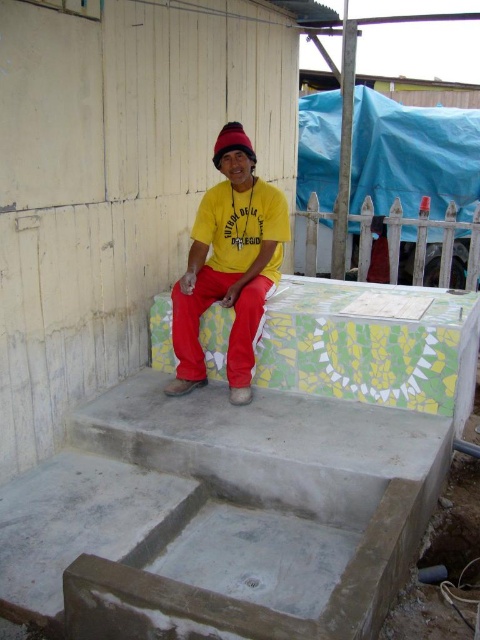
The man in the image is wearing a yellow matte shirt at center and a knitted woolen beanie at center. Which item is positioned lower on his body?

The yellow matte shirt at center is positioned below the knitted woolen beanie at center, so the yellow matte shirt at center is lower on his body.

You are standing at the entrance of the shelter and want to go down the concrete stairs at center. Which direction should you walk to reach them?

Since the concrete stairs at center are located at point (230, 509), you should walk towards the center of the image to reach them.

You are a person who wants to climb the concrete stairs at center while wearing the yellow matte shirt at center. Can you do that comfortably?

The concrete stairs at center has a lesser height compared to yellow matte shirt at center, so yes, you can climb the concrete stairs at center comfortably while wearing the yellow matte shirt at center.